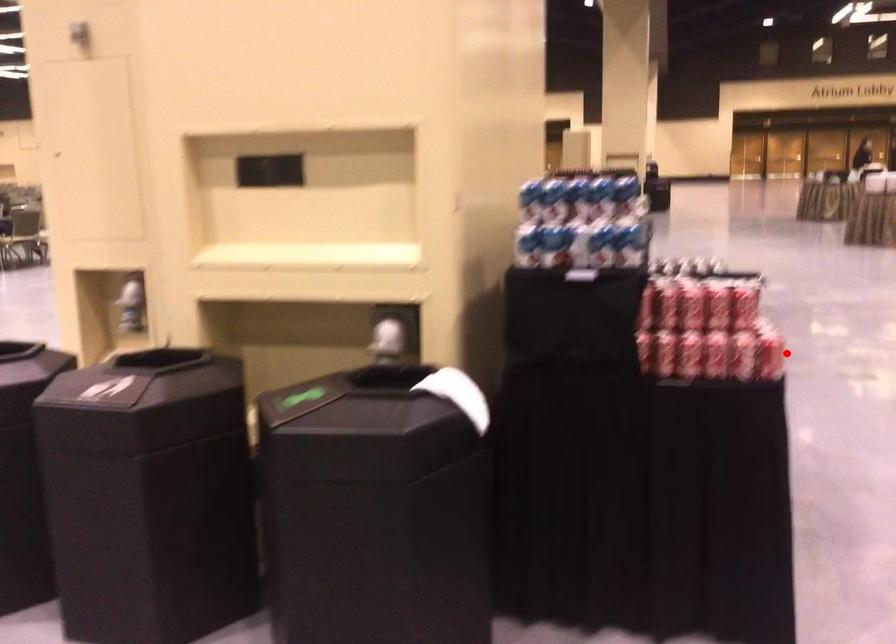
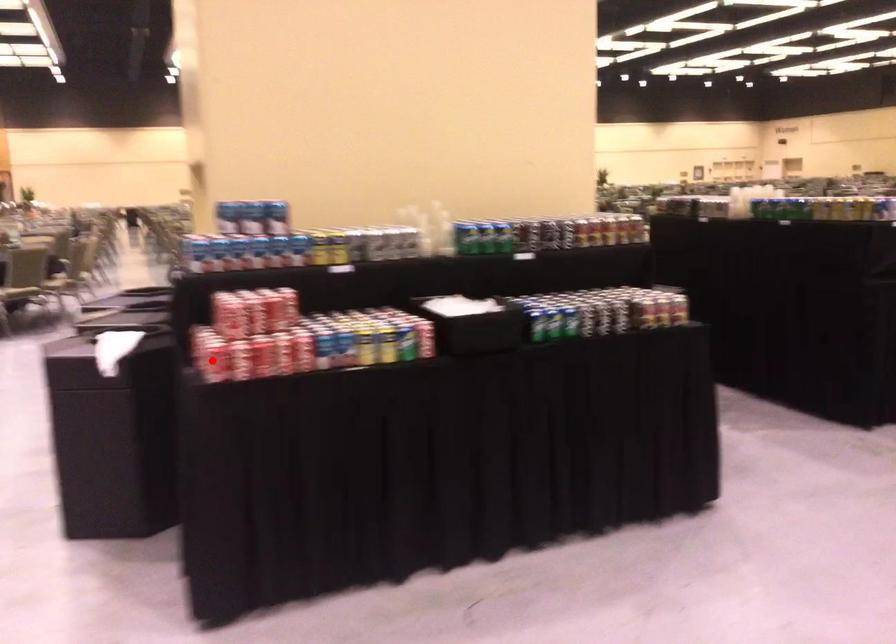
I am providing you with two images of the same scene from different viewpoints. A red point is marked on the first image and another point is marked on the second image. Do the highlighted points in image1 and image2 indicate the same real-world spot?

Yes